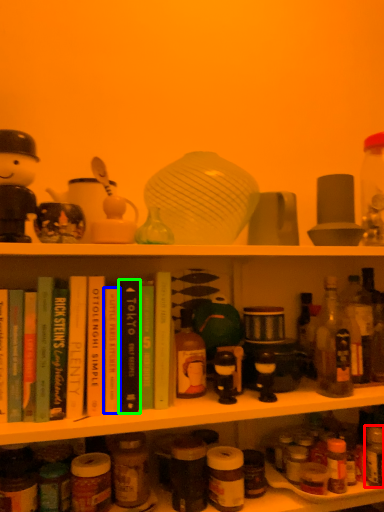
Question: Based on their relative distances, which object is farther from bottle (highlighted by a red box)? Choose from book (highlighted by a blue box) and book (highlighted by a green box).

Choices:
 (A) book
 (B) book

Answer: (A)